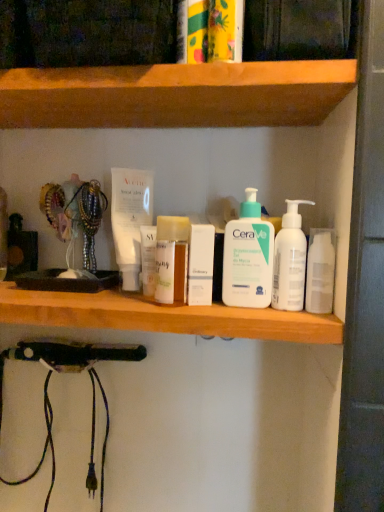
Locate an element on the screen. free space to the left of white matte pump bottle at center, which is the second cleaning product from right to left is located at coordinates (139, 302).